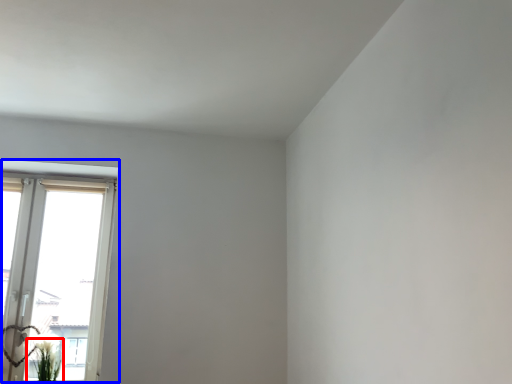
Question: Which point is closer to the camera, plant (highlighted by a red box) or window (highlighted by a blue box)?

Choices:
 (A) plant
 (B) window

Answer: (A)